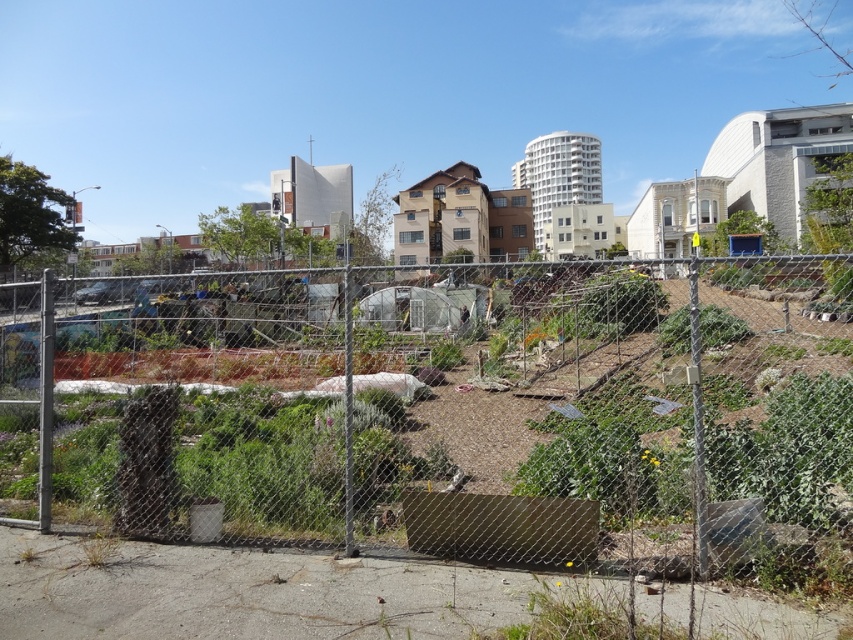
Question: Which point is farther from the camera taking this photo?

Choices:
 (A) (663, 353)
 (B) (724, 364)

Answer: (A)

Question: From the image, what is the correct spatial relationship of metal mesh fence at center in relation to green leafy plant at center?

Choices:
 (A) left
 (B) right

Answer: (A)

Question: Does metal mesh fence at center appear over green leafy plant at center?

Choices:
 (A) no
 (B) yes

Answer: (B)

Question: Can you confirm if metal mesh fence at center is wider than green leafy plant at center?

Choices:
 (A) yes
 (B) no

Answer: (A)